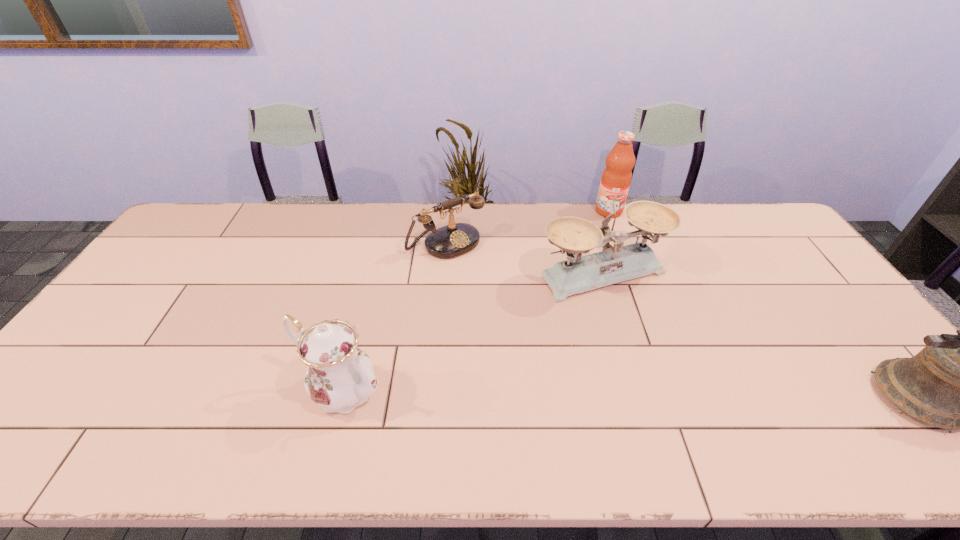
The height and width of the screenshot is (540, 960). In the image, there is a desktop. Find the location of `free space at the right edge`. free space at the right edge is located at coordinates (833, 351).

Image resolution: width=960 pixels, height=540 pixels. I want to click on vacant area that lies between the chinaware and the scale, so click(472, 332).

Where is `free space between the chinaware and the scale`? This screenshot has height=540, width=960. free space between the chinaware and the scale is located at coordinates (472, 332).

The image size is (960, 540). Identify the location of empty location between the fruit juice and the telephone. (528, 227).

Where is `vacant space in between the chinaware and the farthest object`? The width and height of the screenshot is (960, 540). vacant space in between the chinaware and the farthest object is located at coordinates (475, 301).

The width and height of the screenshot is (960, 540). I want to click on empty space that is in between the scale and the shortest object, so click(524, 258).

Point out which object is positioned as the second nearest to the scale. Please provide its 2D coordinates. Your answer should be formatted as a tuple, i.e. [(x, y)], where the tuple contains the x and y coordinates of a point satisfying the conditions above.

[(616, 177)]

Image resolution: width=960 pixels, height=540 pixels. Identify the location of the fourth closest object relative to the chinaware. (957, 382).